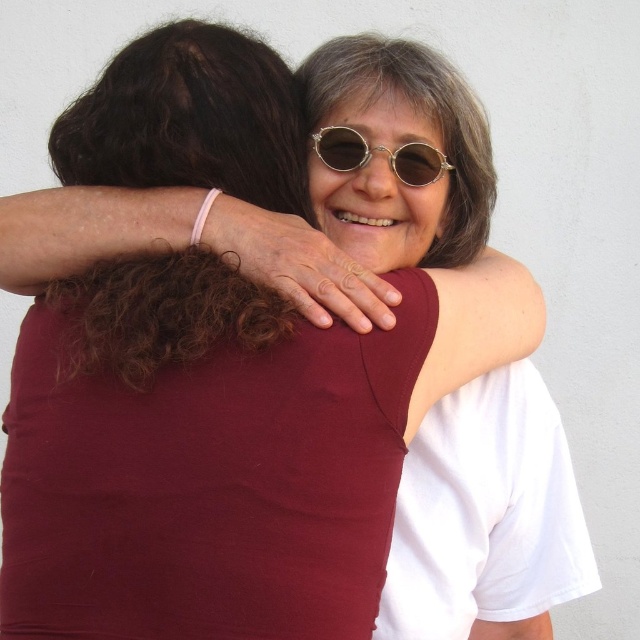
Is pink rubber band at upper center positioned behind gold metallic sunglasses at center?

That is False.

Can you confirm if pink rubber band at upper center is bigger than gold metallic sunglasses at center?

Yes.

Is point (1, 260) farther from camera compared to point (346, 163)?

No, it is in front of (346, 163).

Find the location of a particular element. pink rubber band at upper center is located at coordinates (186, 244).